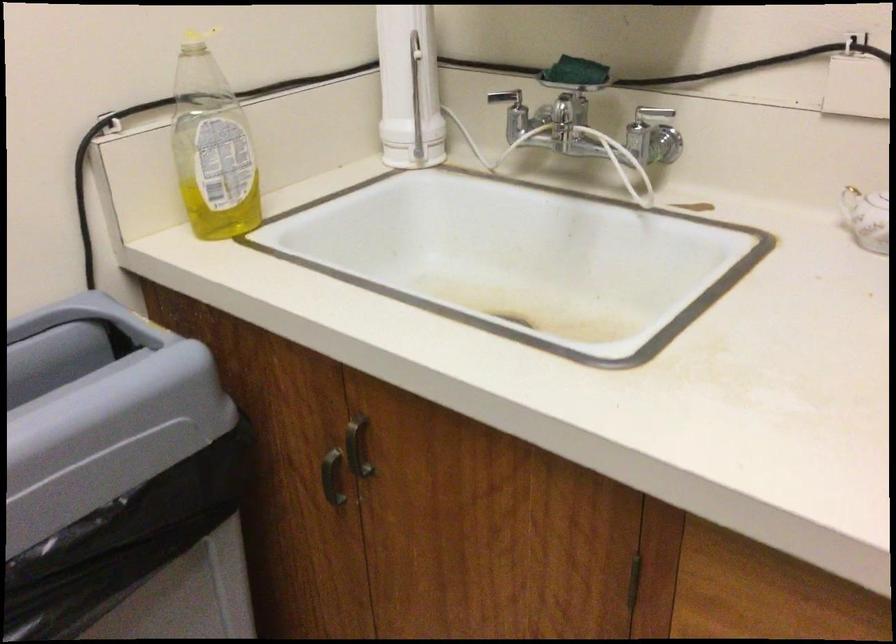
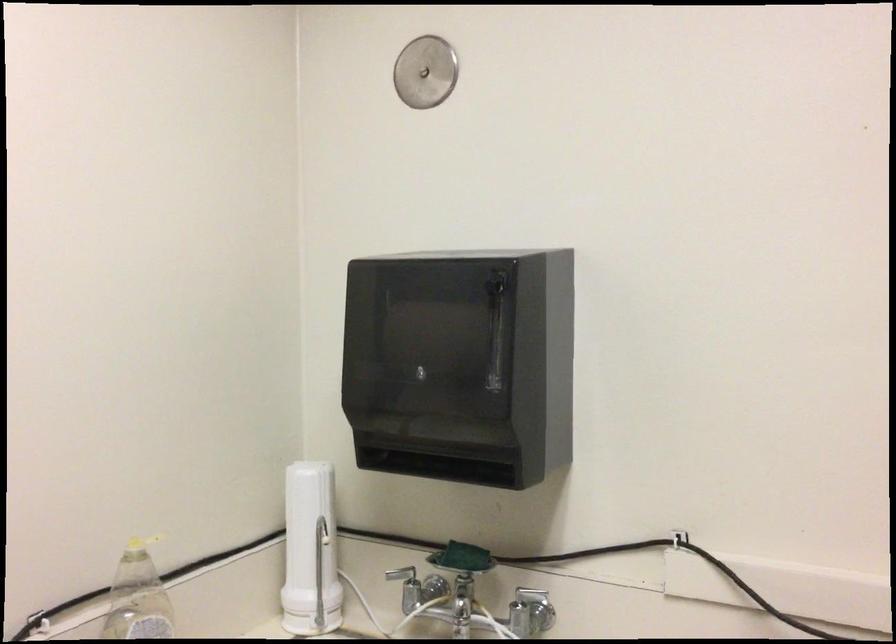
The point at (606, 160) is marked in the first image. Where is the corresponding point in the second image?

(490, 621)